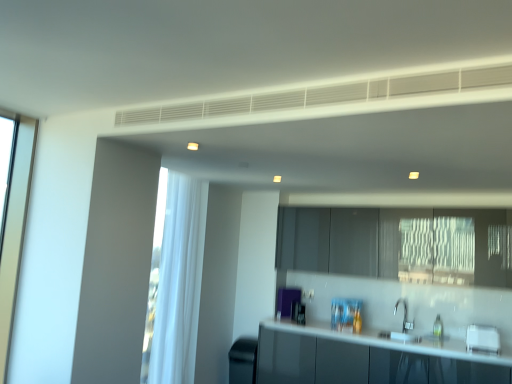
Question: Considering the relative sizes of black matte trash can at lower left, the 2th appliance positioned from the right, and white sheer curtain at left in the image provided, is black matte trash can at lower left, the 2th appliance positioned from the right, smaller than white sheer curtain at left?

Choices:
 (A) no
 (B) yes

Answer: (B)

Question: Is black matte trash can at lower left, which is counted as the first appliance, starting from the bottom, oriented towards white sheer curtain at left?

Choices:
 (A) no
 (B) yes

Answer: (A)

Question: Is black matte trash can at lower left, which is counted as the first appliance, starting from the bottom, positioned before white sheer curtain at left?

Choices:
 (A) yes
 (B) no

Answer: (B)

Question: Is black matte trash can at lower left, which is the second appliance from front to back, far away from white sheer curtain at left?

Choices:
 (A) yes
 (B) no

Answer: (B)

Question: From a real-world perspective, is black matte trash can at lower left, the 2th appliance positioned from the right, physically above white sheer curtain at left?

Choices:
 (A) no
 (B) yes

Answer: (A)

Question: Does black matte trash can at lower left, the 2th appliance positioned from the right, have a lesser height compared to white sheer curtain at left?

Choices:
 (A) no
 (B) yes

Answer: (B)

Question: From a real-world perspective, is matte gray cabinetry at center located beneath glossy white countertop at lower center?

Choices:
 (A) yes
 (B) no

Answer: (B)

Question: Is matte gray cabinetry at center positioned beyond the bounds of glossy white countertop at lower center?

Choices:
 (A) no
 (B) yes

Answer: (B)

Question: Is matte gray cabinetry at center oriented towards glossy white countertop at lower center?

Choices:
 (A) yes
 (B) no

Answer: (B)

Question: Is there a large distance between matte gray cabinetry at center and glossy white countertop at lower center?

Choices:
 (A) no
 (B) yes

Answer: (A)

Question: Considering the relative sizes of matte gray cabinetry at center and glossy white countertop at lower center in the image provided, is matte gray cabinetry at center shorter than glossy white countertop at lower center?

Choices:
 (A) yes
 (B) no

Answer: (A)

Question: Is matte gray cabinetry at center at the left side of glossy white countertop at lower center?

Choices:
 (A) yes
 (B) no

Answer: (B)

Question: Is glossy white countertop at lower center not within white glossy toaster at lower right, the first appliance in the front-to-back sequence?

Choices:
 (A) no
 (B) yes

Answer: (B)